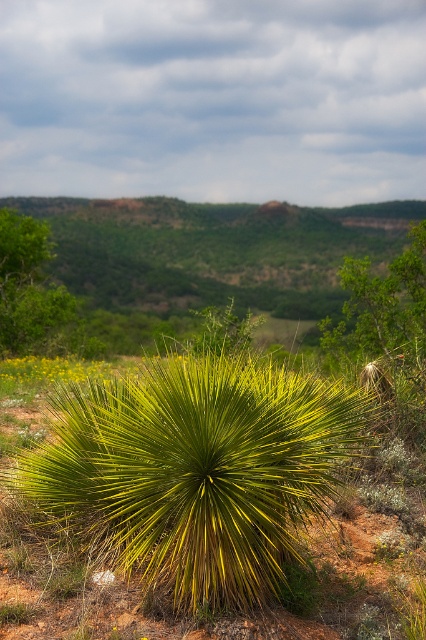
Question: Which object appears closest to the camera in this image?

Choices:
 (A) green leafy hillside at upper center
 (B) green leafy tree at center
 (C) green spiky plant at center

Answer: (C)

Question: Which object appears closest to the camera in this image?

Choices:
 (A) green leafy hillside at upper center
 (B) green spiky plant at center
 (C) green leafy tree at left
 (D) green leafy tree at center

Answer: (B)

Question: Is green leafy tree at center smaller than green leafy tree at left?

Choices:
 (A) no
 (B) yes

Answer: (B)

Question: Is green spiky plant at center above green leafy hillside at upper center?

Choices:
 (A) yes
 (B) no

Answer: (B)

Question: Which of the following is the closest to the observer?

Choices:
 (A) green spiky plant at center
 (B) green leafy hillside at upper center

Answer: (A)

Question: Can you confirm if green spiky plant at center is smaller than green leafy tree at left?

Choices:
 (A) yes
 (B) no

Answer: (A)